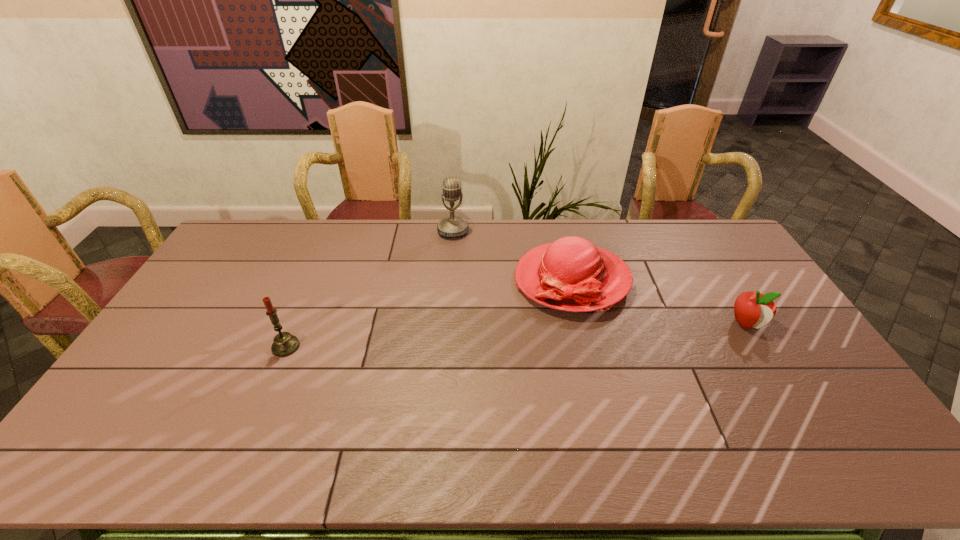
You are a GUI agent. You are given a task and a screenshot of the screen. Output one action in this format:
    pyautogui.click(x=<x>, y=<y>)
    Task: Click on the free spot on the desktop that is between the second tallest object and the apple and is positioned at the front of the third tallest object with a bow
    The height and width of the screenshot is (540, 960).
    Given the screenshot: What is the action you would take?
    pyautogui.click(x=458, y=338)

Where is `vacant space on the desktop that is between the candle and the rightmost object and is positioned on the front-facing side of the second object from left to right`? The image size is (960, 540). vacant space on the desktop that is between the candle and the rightmost object and is positioned on the front-facing side of the second object from left to right is located at coordinates tap(461, 338).